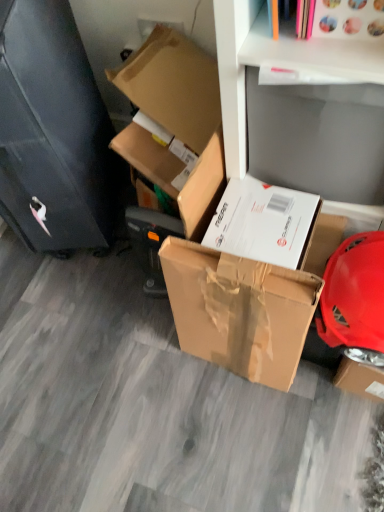
Question: From the image's perspective, is white matte shelf at upper center located beneath brown cardboard box at center, the second box in the top-to-bottom sequence?

Choices:
 (A) no
 (B) yes

Answer: (A)

Question: Can you confirm if white matte shelf at upper center is bigger than brown cardboard box at center, the second box in the top-to-bottom sequence?

Choices:
 (A) yes
 (B) no

Answer: (A)

Question: Considering the relative sizes of white matte shelf at upper center and brown cardboard box at center, which is the 1th box in bottom-to-top order, in the image provided, is white matte shelf at upper center shorter than brown cardboard box at center, which is the 1th box in bottom-to-top order,?

Choices:
 (A) yes
 (B) no

Answer: (A)

Question: Is white matte shelf at upper center wider than brown cardboard box at center, the second box in the top-to-bottom sequence?

Choices:
 (A) no
 (B) yes

Answer: (B)

Question: From the image's perspective, is white matte shelf at upper center above brown cardboard box at center, the second box in the top-to-bottom sequence?

Choices:
 (A) yes
 (B) no

Answer: (A)

Question: Is white matte shelf at upper center positioned with its back to brown cardboard box at center, the second box in the top-to-bottom sequence?

Choices:
 (A) yes
 (B) no

Answer: (B)

Question: Are brown cardboard box at center, which is the 1th box in bottom-to-top order, and white matte shelf at upper center beside each other?

Choices:
 (A) yes
 (B) no

Answer: (B)

Question: From a real-world perspective, is brown cardboard box at center, the second box in the top-to-bottom sequence, under white matte shelf at upper center?

Choices:
 (A) no
 (B) yes

Answer: (B)

Question: Is brown cardboard box at center, the second box in the top-to-bottom sequence, bigger than white matte shelf at upper center?

Choices:
 (A) no
 (B) yes

Answer: (A)

Question: Does brown cardboard box at center, the second box in the top-to-bottom sequence, have a smaller size compared to white matte shelf at upper center?

Choices:
 (A) yes
 (B) no

Answer: (A)

Question: Is white matte shelf at upper center completely or partially inside brown cardboard box at center, which is the 1th box in bottom-to-top order?

Choices:
 (A) yes
 (B) no

Answer: (B)

Question: Is brown cardboard box at center, which is the 1th box in bottom-to-top order, thinner than white matte shelf at upper center?

Choices:
 (A) no
 (B) yes

Answer: (B)

Question: From a real-world perspective, is brown cardboard box at upper left, positioned as the second box in bottom-to-top order, beneath white matte shelf at upper center?

Choices:
 (A) no
 (B) yes

Answer: (B)